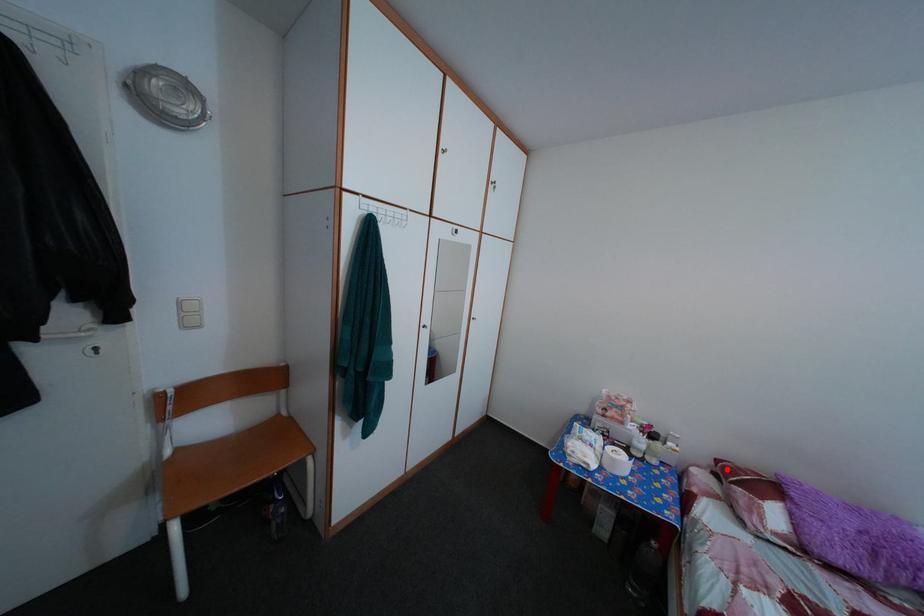
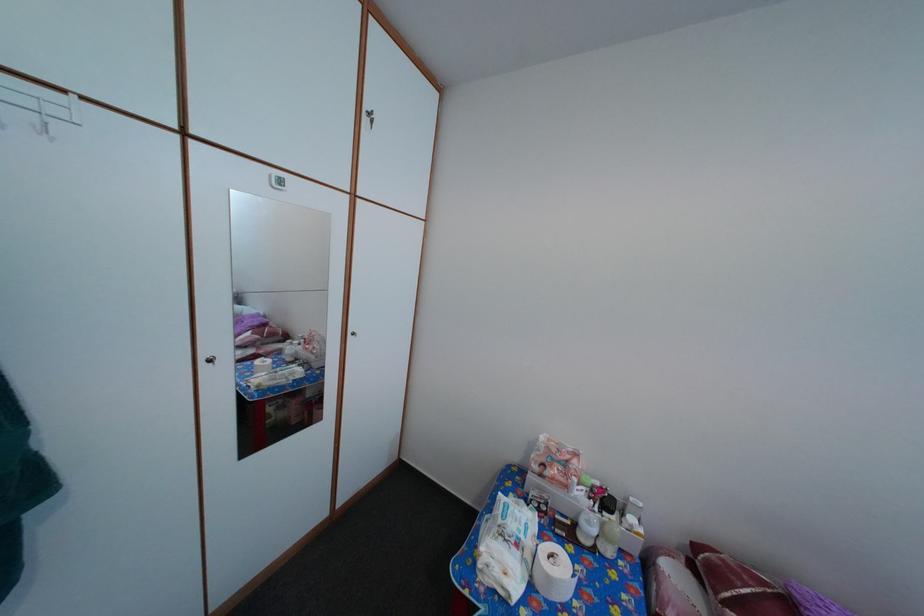
The point at the highlighted location is marked in the first image. Where is the corresponding point in the second image?

(704, 554)